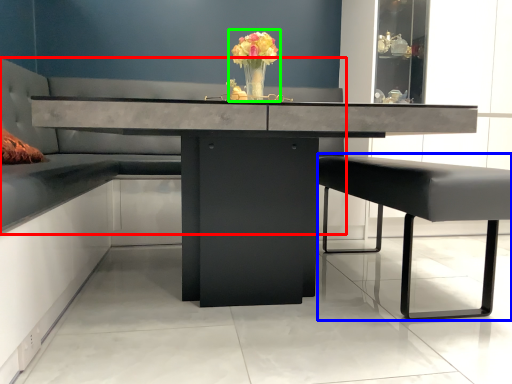
Question: Which object is positioned closest to couch (highlighted by a red box)? Select from swivel chair (highlighted by a blue box) and floral arrangement (highlighted by a green box).

Choices:
 (A) swivel chair
 (B) floral arrangement

Answer: (B)